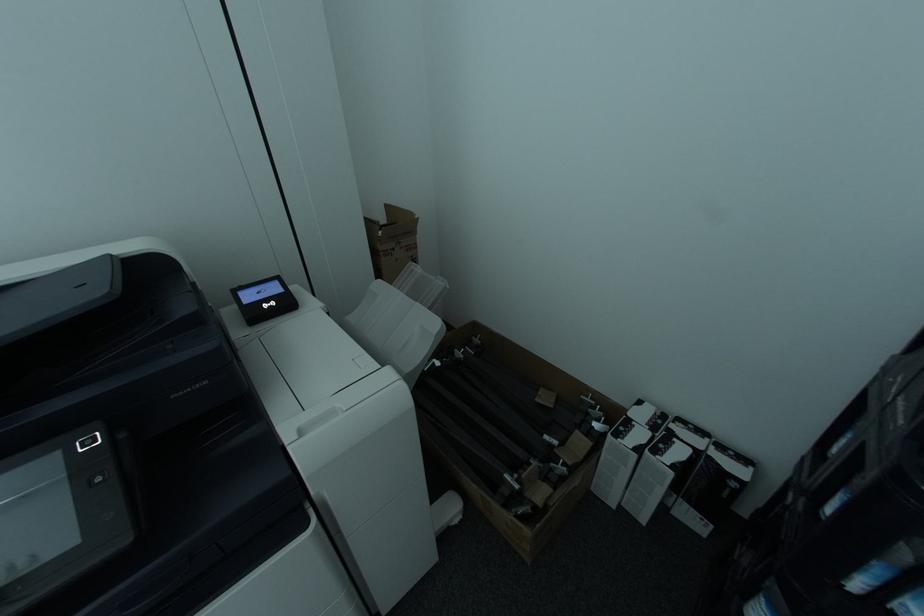
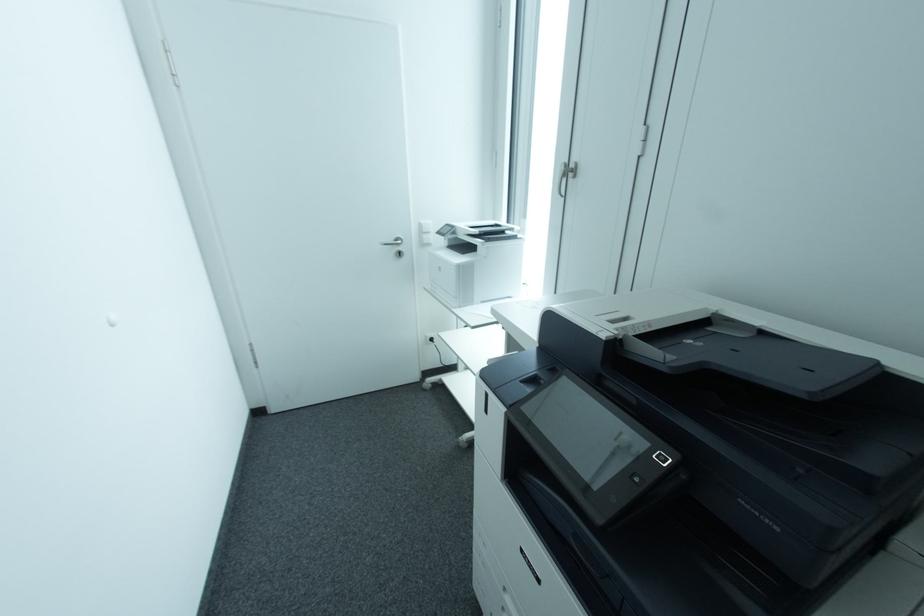
Based on the continuous images, in which direction is the camera rotating?

The camera's rotation is toward left-down.